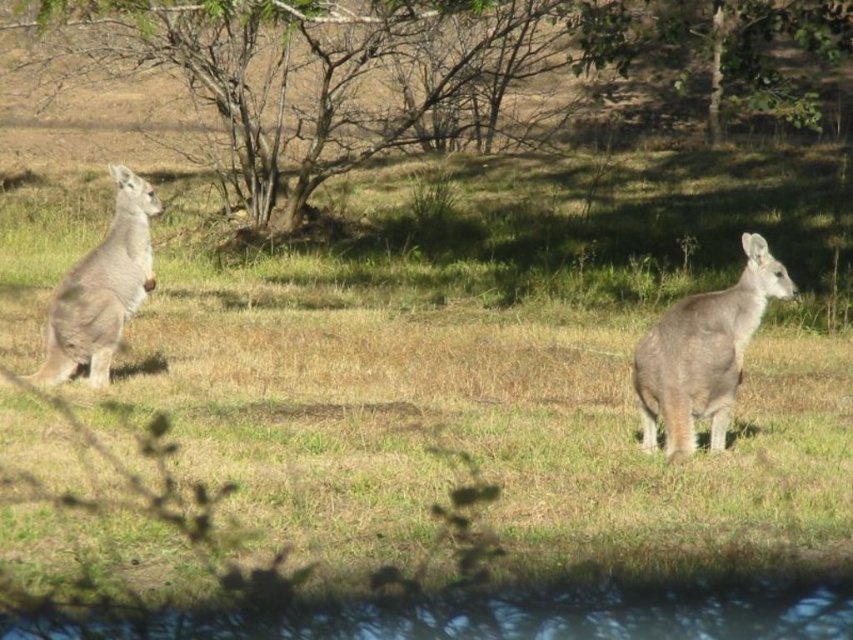
You are a bird flying over the field and want to land on the closest object. Which object would you choose between the brown bark tree at upper center and the gray fur kangaroo at right?

The brown bark tree at upper center is taller than the gray fur kangaroo at right, so the gray fur kangaroo at right is closer to the ground. Therefore, the bird should land on the gray fur kangaroo at right since it is lower and easier to reach.

You are standing in the grassy field and want to take a photo of the brown bark tree at upper center. To ensure the tree is centered in your camera viewfinder, where should you aim your camera? Please provide the coordinates as a point in the format of a tuple with two decimal numbers between 0 and 1, where the origin is the bottom left corner of the image.

The brown bark tree at upper center is located at coordinates point (432, 65), so you should aim your camera at the point (432, 65) to center it in the viewfinder.